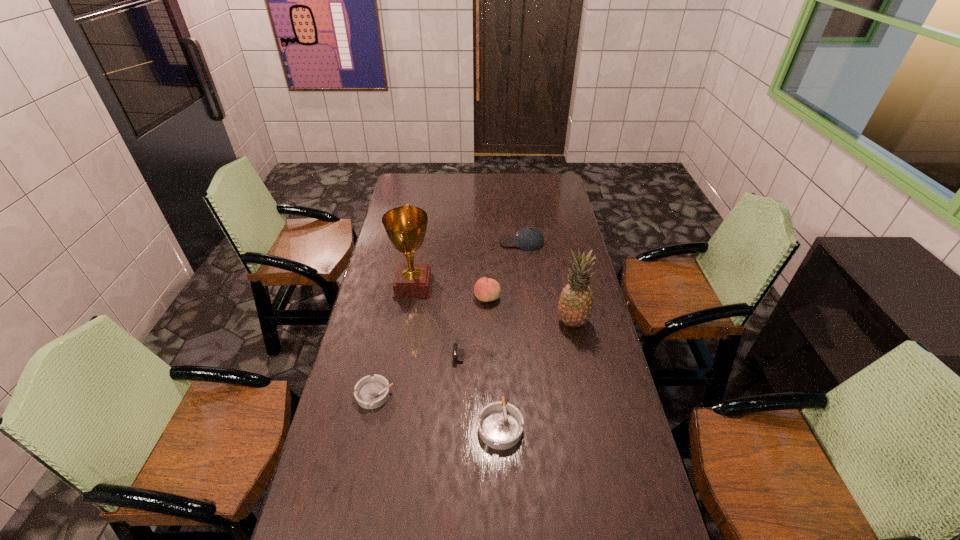
Locate an element on the screen. vacant space that satisfies the following two spatial constraints: 1. on the back side of the shorter ashtray; 2. on the right side of the fourth nearest object is located at coordinates (390, 322).

The width and height of the screenshot is (960, 540). In order to click on vacant region that satisfies the following two spatial constraints: 1. on the plaque of the right ashtray; 2. on the left side of the award in this screenshot , I will do `click(390, 426)`.

In order to click on vacant space that satisfies the following two spatial constraints: 1. on the plaque of the award; 2. on the back side of the pineapple in this screenshot , I will do `click(407, 322)`.

Where is `vacant area that satisfies the following two spatial constraints: 1. on the front-facing side of the farthest object; 2. on the front side of the left ashtray`? This screenshot has width=960, height=540. vacant area that satisfies the following two spatial constraints: 1. on the front-facing side of the farthest object; 2. on the front side of the left ashtray is located at coordinates (540, 395).

Find the location of a particular element. The height and width of the screenshot is (540, 960). vacant space that satisfies the following two spatial constraints: 1. on the front-facing side of the third nearest object; 2. on the left side of the taller ashtray is located at coordinates (480, 426).

The image size is (960, 540). What are the coordinates of `blank space that satisfies the following two spatial constraints: 1. on the front-facing side of the fifth farthest object; 2. on the left side of the taller ashtray` in the screenshot? It's located at (480, 426).

Image resolution: width=960 pixels, height=540 pixels. I want to click on vacant position in the image that satisfies the following two spatial constraints: 1. on the plaque of the fourth farthest object; 2. on the left side of the award, so click(407, 322).

This screenshot has width=960, height=540. In order to click on free point that satisfies the following two spatial constraints: 1. on the back side of the pineapple; 2. on the front-facing side of the farthest object in this screenshot , I will do `click(555, 242)`.

Identify the location of free space that satisfies the following two spatial constraints: 1. on the plaque of the award; 2. on the left side of the pineapple. This screenshot has width=960, height=540. (407, 322).

Where is `blank space that satisfies the following two spatial constraints: 1. on the back side of the taller ashtray; 2. on the front-facing side of the webcam`? blank space that satisfies the following two spatial constraints: 1. on the back side of the taller ashtray; 2. on the front-facing side of the webcam is located at coordinates (497, 355).